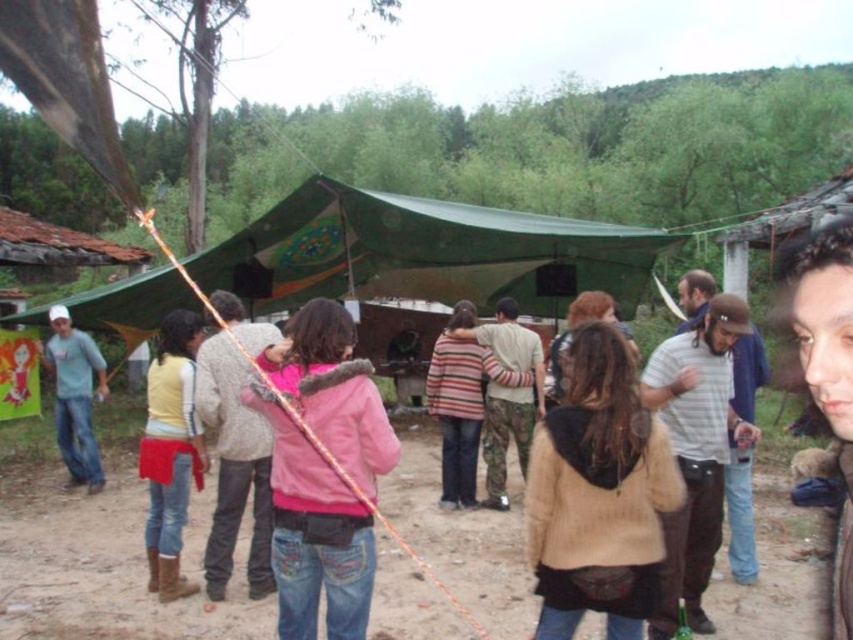
Question: Is green canvas tent at center smaller than pink fleece jacket at center?

Choices:
 (A) no
 (B) yes

Answer: (B)

Question: Which of these objects is positioned closest to the striped sweater at center?

Choices:
 (A) brown fuzzy coat at center
 (B) yellow-green sweater at center-left
 (C) pink fleece jacket at center
 (D) green canvas tent at center

Answer: (B)

Question: Which object is closer to the camera taking this photo?

Choices:
 (A) striped sweater at center
 (B) pink fuzzy jacket at center
 (C) pink fleece jacket at center
 (D) green canvas tent at center

Answer: (C)

Question: Can you confirm if pink fleece jacket at center is positioned to the left of gray striped shirt at center-right?

Choices:
 (A) yes
 (B) no

Answer: (A)

Question: Is brown fuzzy coat at center to the right of striped sweater at center from the viewer's perspective?

Choices:
 (A) no
 (B) yes

Answer: (B)

Question: Which point is closer to the camera taking this photo?

Choices:
 (A) (294, 208)
 (B) (88, 358)

Answer: (B)